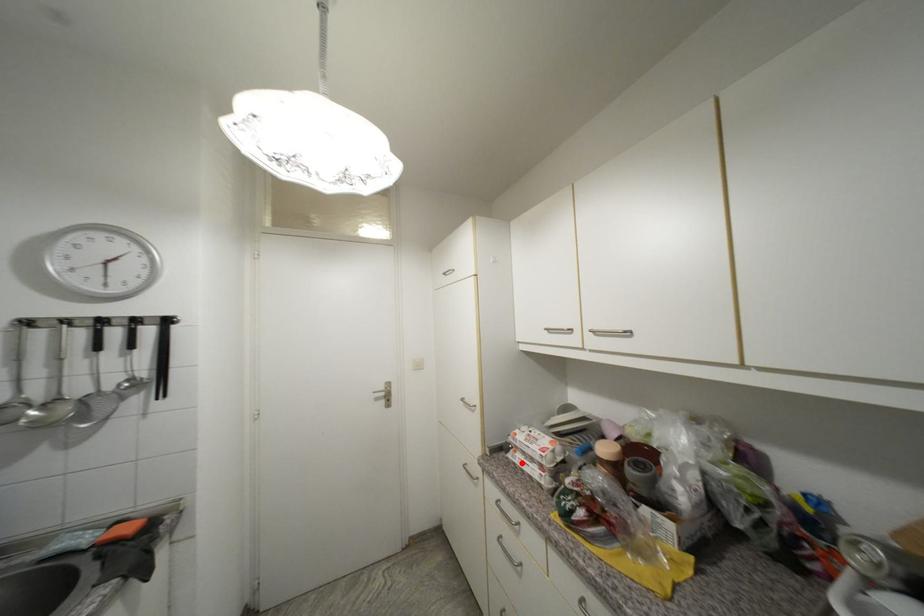
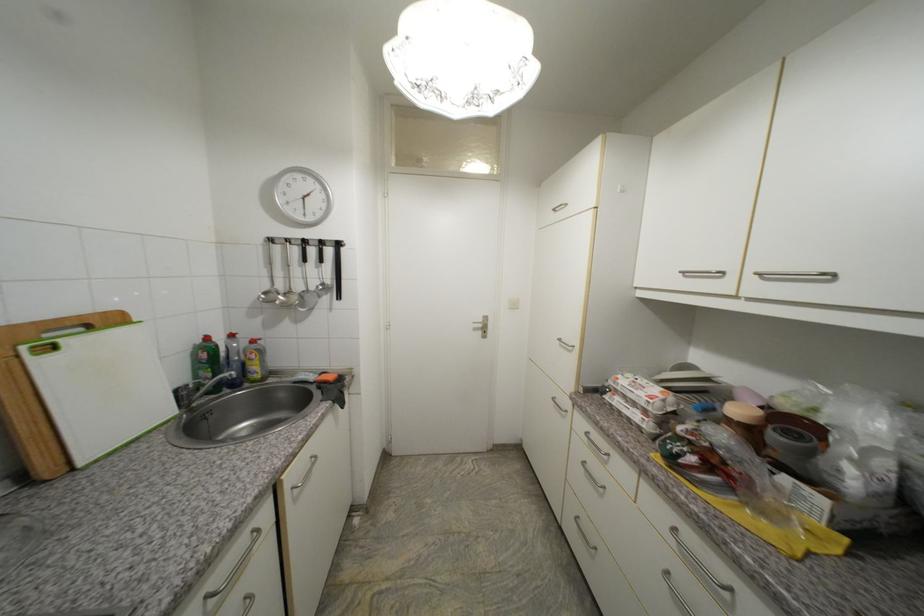
Question: I am providing you with two images of the same scene from different viewpoints. A red point is marked on the first image. At the location where the point appears in image 1, is it still visible in image 2?

Choices:
 (A) Yes
 (B) No

Answer: (A)